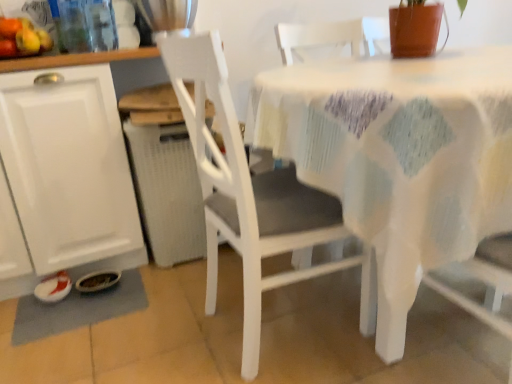
Question: Is gray fabric place mat at lower left at the right side of white fabric-covered table at center?

Choices:
 (A) no
 (B) yes

Answer: (A)

Question: Is gray fabric place mat at lower left touching white fabric-covered table at center?

Choices:
 (A) no
 (B) yes

Answer: (A)

Question: Does gray fabric place mat at lower left have a larger size compared to white fabric-covered table at center?

Choices:
 (A) no
 (B) yes

Answer: (A)

Question: Is gray fabric place mat at lower left shorter than white fabric-covered table at center?

Choices:
 (A) yes
 (B) no

Answer: (A)

Question: Is gray fabric place mat at lower left thinner than white fabric-covered table at center?

Choices:
 (A) yes
 (B) no

Answer: (A)

Question: Can you confirm if gray fabric place mat at lower left is taller than white fabric-covered table at center?

Choices:
 (A) no
 (B) yes

Answer: (A)

Question: Is the depth of white fabric-covered table at center greater than that of white matte chair at center?

Choices:
 (A) yes
 (B) no

Answer: (B)

Question: Is white fabric-covered table at center closer to camera compared to white matte chair at center?

Choices:
 (A) yes
 (B) no

Answer: (A)

Question: Considering the relative sizes of white fabric-covered table at center and white matte chair at center in the image provided, is white fabric-covered table at center taller than white matte chair at center?

Choices:
 (A) no
 (B) yes

Answer: (A)

Question: Can you confirm if white fabric-covered table at center is smaller than white matte chair at center?

Choices:
 (A) yes
 (B) no

Answer: (B)

Question: Does white fabric-covered table at center have a lesser width compared to white matte chair at center?

Choices:
 (A) no
 (B) yes

Answer: (A)

Question: Is white fabric-covered table at center next to white matte chair at center and touching it?

Choices:
 (A) no
 (B) yes

Answer: (A)

Question: Can you confirm if gray fabric place mat at lower left is taller than white matte cabinet at left?

Choices:
 (A) no
 (B) yes

Answer: (A)